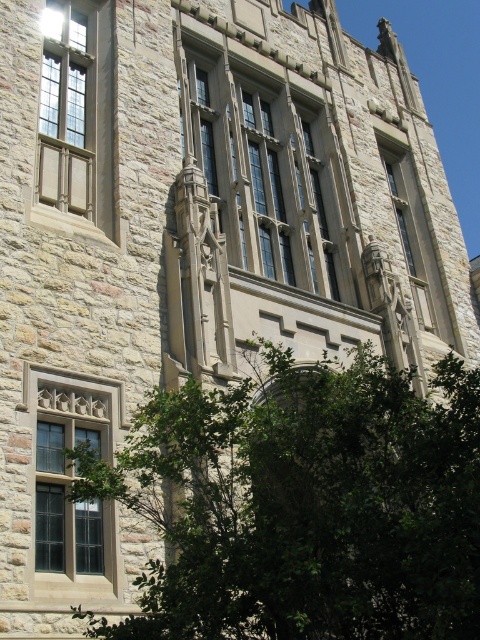
Is point (253, 120) positioned in front of point (73, 428)?

No, (253, 120) is behind (73, 428).

Does stone textured window at center appear on the left side of dark gray stone window at lower left?

In fact, stone textured window at center is to the right of dark gray stone window at lower left.

Measure the distance between point (286,148) and camera.

Point (286,148) and camera are 207.37 feet apart from each other.

The height and width of the screenshot is (640, 480). Find the location of `stone textured window at center`. stone textured window at center is located at coordinates (264, 164).

Who is more forward, (427, 515) or (245, 141)?

Point (427, 515) is more forward.

Can you confirm if green leafy tree at lower left is positioned above stone textured window at center?

No.

Measure the distance between green leafy tree at lower left and camera.

green leafy tree at lower left and camera are 20.86 meters apart.

The height and width of the screenshot is (640, 480). I want to click on green leafy tree at lower left, so click(x=303, y=504).

Which is in front, point (444, 611) or point (403, 150)?

Point (444, 611)

Describe the element at coordinates (303, 504) in the screenshot. I see `green leafy tree at lower left` at that location.

What are the coordinates of `green leafy tree at lower left` in the screenshot? It's located at (303, 504).

At what (x,y) coordinates should I click in order to perform the action: click on green leafy tree at lower left. Please return your answer as a coordinate pair (x, y). This screenshot has width=480, height=640. Looking at the image, I should click on (303, 504).